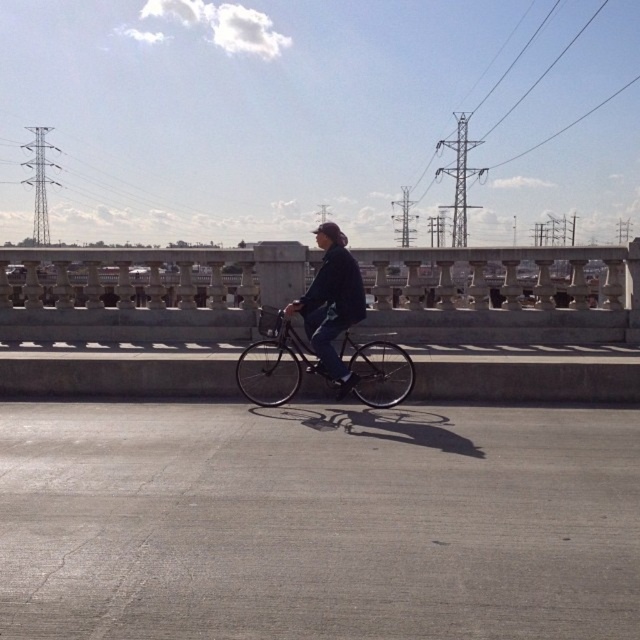
You are a delivery person who needs to carry a large package that is 1 meter wide. You see the shiny black bicycle at center and the dark blue denim jacket at center. Can you determine if the bicycle can accommodate the package width based on their sizes?

The shiny black bicycle at center might be wider than the dark blue denim jacket at center. Since the package is 1 meter wide, if the bicycle is wider than the jacket, it might be able to accommodate the package, but there is uncertainty due to the comparison not being definitive.

You are a delivery person who needs to place a package on the shiny black bicycle at center. The package is 50 centimeters long. Can you fit the package horizontally on the bicycle without it overlapping the dark blue denim jacket at center?

The shiny black bicycle at center is 53.61 centimeters away from dark blue denim denim jacket at center. Since the package is only 50 centimeters long, it can be placed horizontally on the bicycle without overlapping the jacket as there is sufficient space between them.

You are a photographer standing on the path. You want to take a photo of the shiny black bicycle at center and the dark blue denim jacket at center. Which object should you focus on first if you want the one closer to you to be in sharp focus?

The dark blue denim jacket at center is closer to you than the shiny black bicycle at center, so you should focus on the dark blue denim jacket at center first to ensure it is in sharp focus.